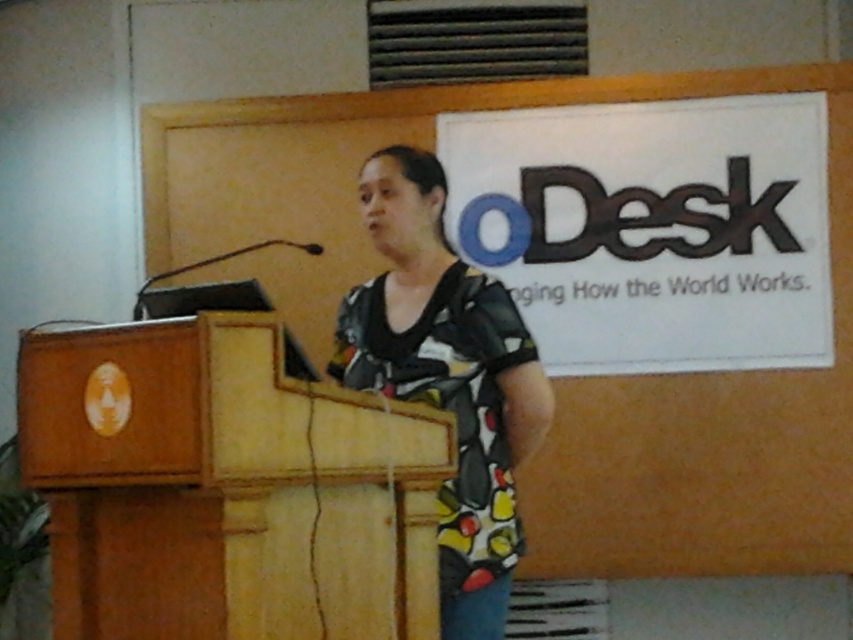
You are an event organizer who needs to adjust the microphone on the wooden podium at center so it faces the printed fabric blouse at center. Which direction should you move the microphone?

The wooden podium at center is to the left of the printed fabric blouse at center, so you should move the microphone to the right to face the printed fabric blouse at center.

You are an event organizer setting up a stage for a presentation. You need to place a new microphone stand that must be positioned closer to the audience than the wooden podium at center. Can you place it behind the printed fabric blouse at center?

The wooden podium at center is closer to the viewer than the printed fabric blouse at center. Therefore, placing the microphone stand behind the printed fabric blouse at center would position it further away from the audience, which is not desired. Instead, the microphone stand should be placed in front of the wooden podium at center to be closer to the audience.

You are a photographer adjusting your camera settings. You notice two points in the scene, one at point (196, 556) and another at point (457, 392). Which point should you focus on to ensure it appears sharper in the final photo?

Point (196, 556) is closer to the camera than point (457, 392), so focusing on point (196, 556) will make it appear sharper in the photo.